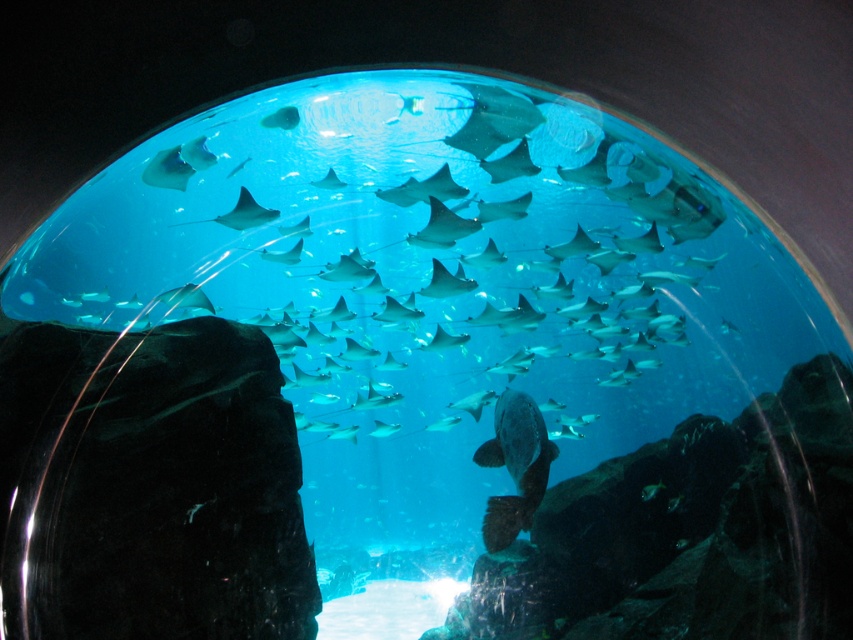
You are an aquarium maintenance worker checking the tank. You notice the dark gray matte fish at center and the translucent blue fish at upper center. Which fish do you think requires more space to swim comfortably?

The dark gray matte fish at center requires more space to swim comfortably since it has a larger size compared to the translucent blue fish at upper center.

You are a marine biologist observing the underwater scene through the curved glass dome. You notice a point marked at coordinates (492, 120). Which object is located at this point?

The point at coordinates (492, 120) indicates the smooth gray stingray at upper center.